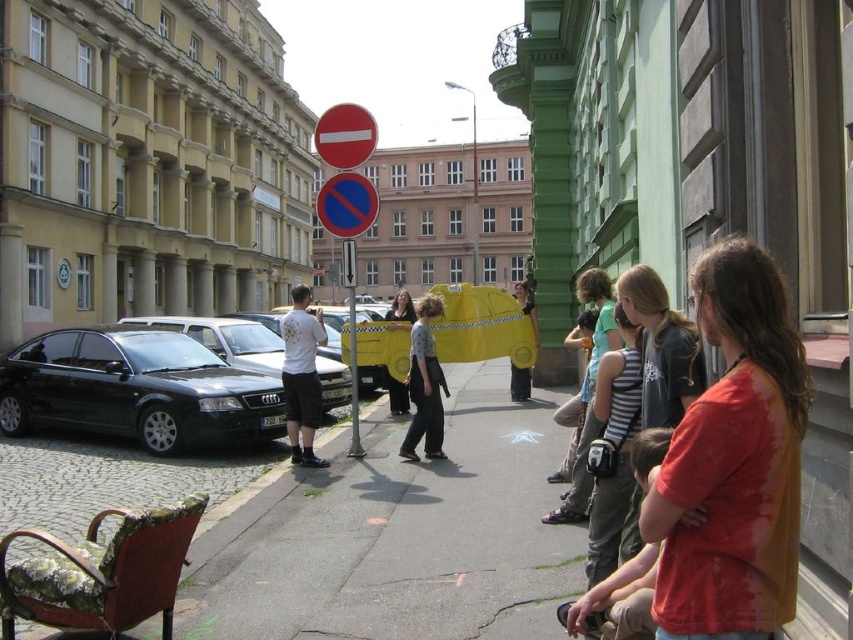
Question: Is smooth plastic circle at center to the right of matte black dress at center from the viewer's perspective?

Choices:
 (A) no
 (B) yes

Answer: (B)

Question: Can you confirm if smooth plastic circle at center is thinner than matte black dress at center?

Choices:
 (A) yes
 (B) no

Answer: (A)

Question: Which of these objects is positioned closest to the light blue denim jeans at center?

Choices:
 (A) shiny black car at left
 (B) tie-dye cotton shirt at center-right

Answer: (B)

Question: Is white matte t-shirt at center smaller than red matte sign at center?

Choices:
 (A) no
 (B) yes

Answer: (B)

Question: Which of these objects is positioned closest to the red matte sign at center?

Choices:
 (A) matte yellow t-shirt at center
 (B) smooth plastic circle at center

Answer: (B)

Question: Among these points, which one is farthest from the camera?

Choices:
 (A) (534, 320)
 (B) (233, 417)
 (C) (270, 353)
 (D) (401, 323)

Answer: (A)